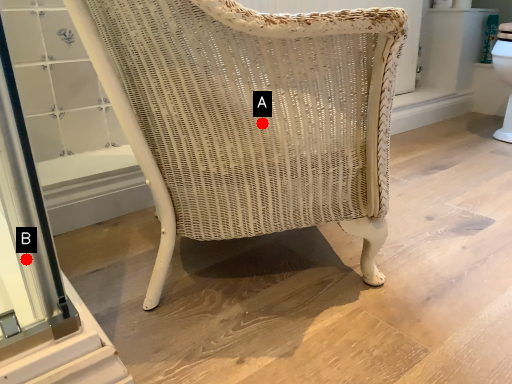
Question: Two points are circled on the image, labeled by A and B beside each circle. Which point appears closest to the camera in this image?

Choices:
 (A) A is closer
 (B) B is closer

Answer: (B)